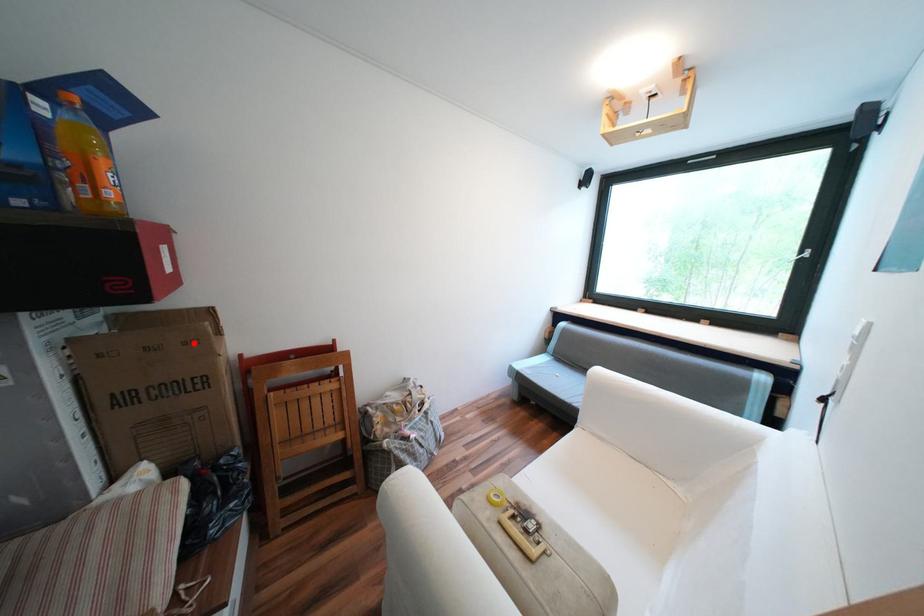
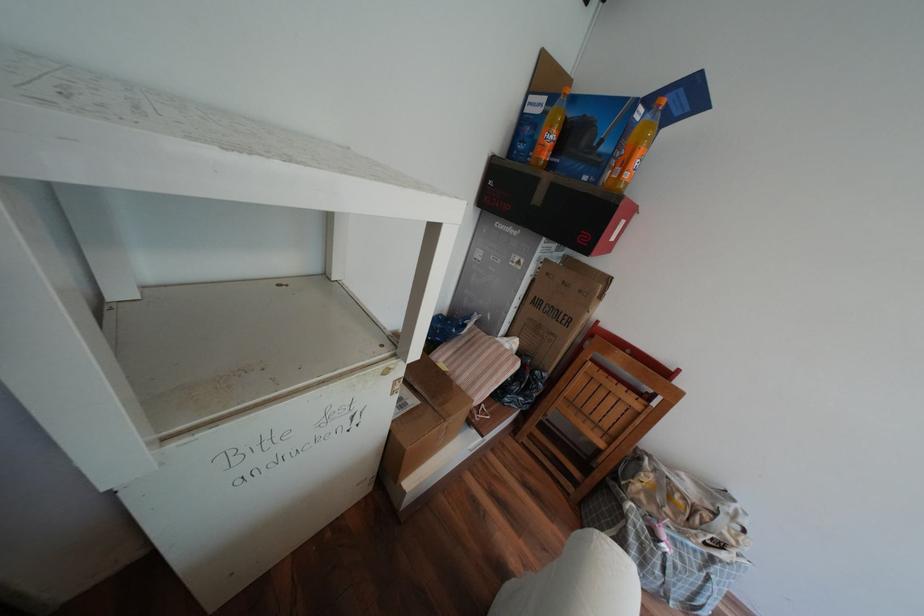
Find the pixel in the second image that matches the highlighted location in the first image.

(590, 291)